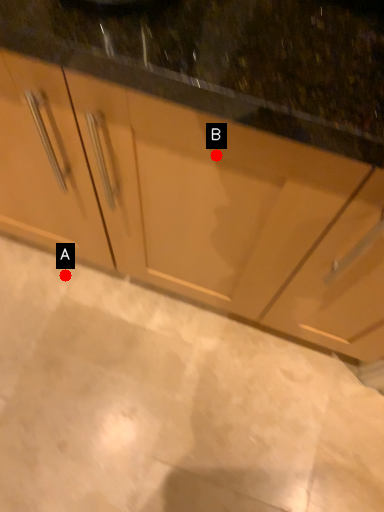
Question: Two points are circled on the image, labeled by A and B beside each circle. Among these points, which one is nearest to the camera?

Choices:
 (A) A is closer
 (B) B is closer

Answer: (B)